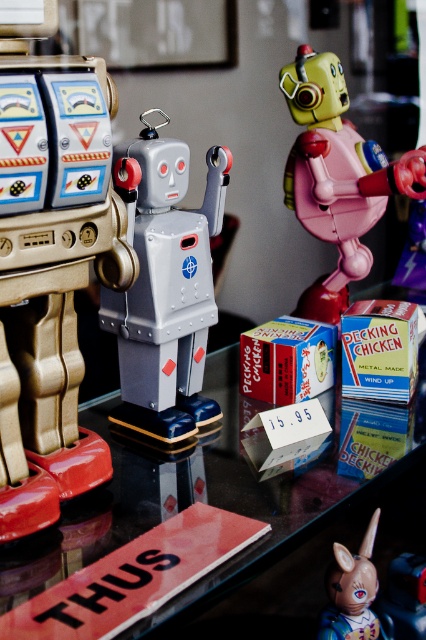
Question: Is metallic glass table at center smaller than matte plastic unicorn at lower right?

Choices:
 (A) no
 (B) yes

Answer: (A)

Question: Which point is farther to the camera?

Choices:
 (A) pos(337,292)
 (B) pos(368,573)
 (C) pos(207,292)
 (D) pos(34,499)

Answer: (A)

Question: Is metallic glass table at center above metallic pink robot at center?

Choices:
 (A) no
 (B) yes

Answer: (A)

Question: Which of the following is the closest to the observer?

Choices:
 (A) (49, 509)
 (B) (137, 381)

Answer: (A)

Question: Is metallic glass table at center below matte plastic unicorn at lower right?

Choices:
 (A) yes
 (B) no

Answer: (B)

Question: Which of these objects is positioned farthest from the matte plastic unicorn at lower right?

Choices:
 (A) metallic silver robot at center
 (B) metallic glass table at center

Answer: (A)